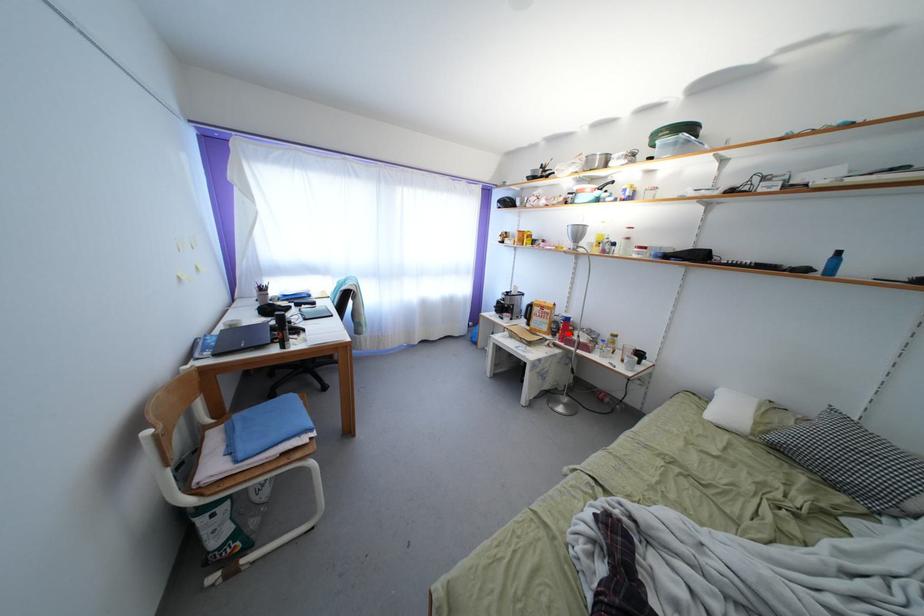
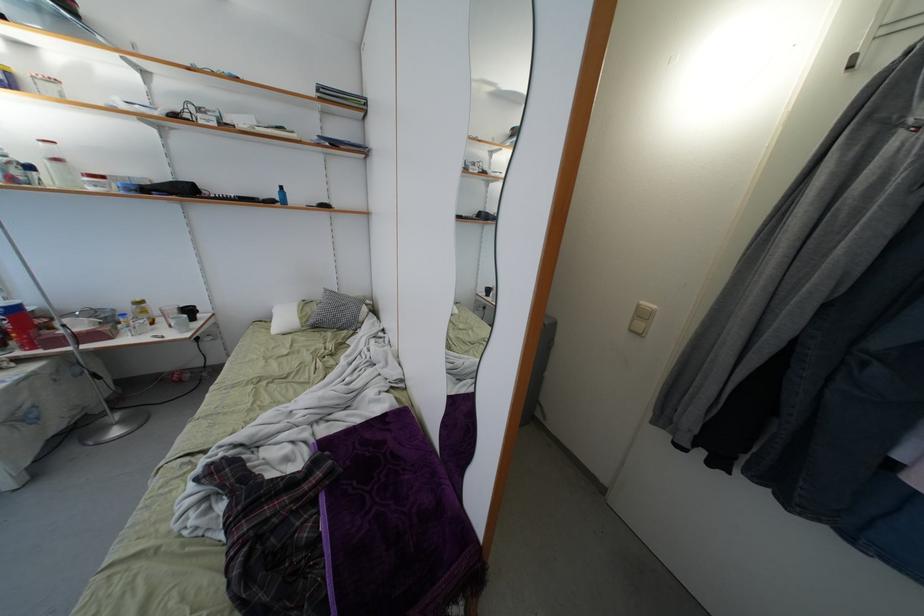
In the second image, find the point that corresponds to the highlighted location in the first image.

(22, 333)